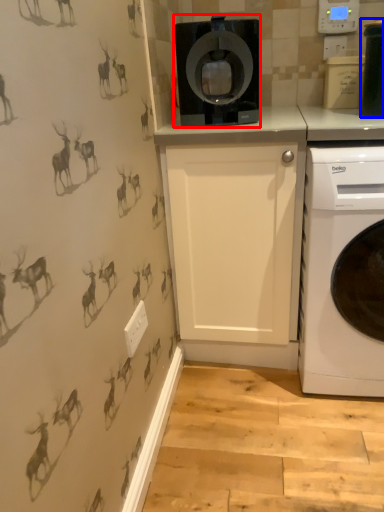
Question: Which point is closer to the camera, home appliance (highlighted by a red box) or appliance (highlighted by a blue box)?

Choices:
 (A) home appliance
 (B) appliance

Answer: (B)